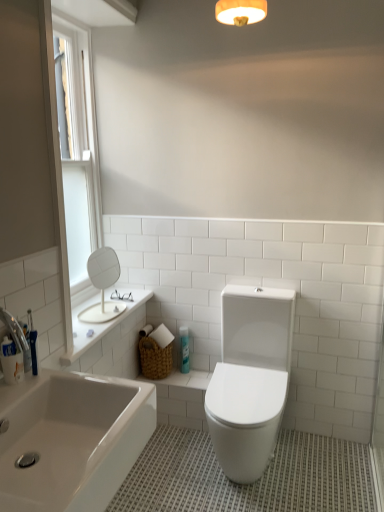
Question: Does white glossy bathtub at lower left contain white plastic window screen at upper left?

Choices:
 (A) yes
 (B) no

Answer: (B)

Question: Is white glossy bathtub at lower left shorter than white plastic window screen at upper left?

Choices:
 (A) no
 (B) yes

Answer: (B)

Question: Are white glossy bathtub at lower left and white plastic window screen at upper left located far from each other?

Choices:
 (A) yes
 (B) no

Answer: (A)

Question: From a real-world perspective, does white glossy bathtub at lower left sit lower than white plastic window screen at upper left?

Choices:
 (A) no
 (B) yes

Answer: (B)

Question: Does white glossy bathtub at lower left have a larger size compared to white plastic window screen at upper left?

Choices:
 (A) yes
 (B) no

Answer: (A)

Question: Can you confirm if white glossy bathtub at lower left is wider than white plastic window screen at upper left?

Choices:
 (A) yes
 (B) no

Answer: (A)

Question: From a real-world perspective, is blue glossy spray can at center physically above white plastic window screen at upper left?

Choices:
 (A) no
 (B) yes

Answer: (A)

Question: Is blue glossy spray can at center oriented towards white plastic window screen at upper left?

Choices:
 (A) no
 (B) yes

Answer: (A)

Question: Can you confirm if blue glossy spray can at center is shorter than white plastic window screen at upper left?

Choices:
 (A) yes
 (B) no

Answer: (A)

Question: Is blue glossy spray can at center to the left of white plastic window screen at upper left from the viewer's perspective?

Choices:
 (A) yes
 (B) no

Answer: (B)

Question: Is white plastic window screen at upper left a part of blue glossy spray can at center?

Choices:
 (A) yes
 (B) no

Answer: (B)

Question: Is blue glossy spray can at center taller than white plastic window screen at upper left?

Choices:
 (A) no
 (B) yes

Answer: (A)

Question: Is white matte round mirror at upper left positioned before white glossy toilet at center?

Choices:
 (A) yes
 (B) no

Answer: (B)